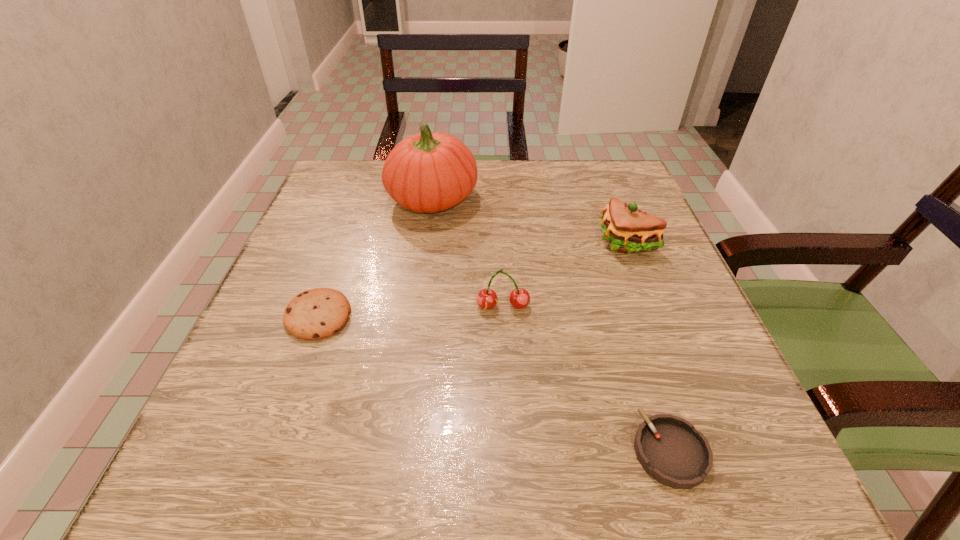
The height and width of the screenshot is (540, 960). In the image, there is a desktop. What are the coordinates of `vacant space at the right edge` in the screenshot? It's located at (619, 309).

This screenshot has width=960, height=540. In the image, there is a desktop. Find the location of `vacant space at the far left corner`. vacant space at the far left corner is located at coordinates (319, 199).

The image size is (960, 540). What are the coordinates of `vacant region at the near right corner of the desktop` in the screenshot? It's located at (675, 500).

Where is `unoccupied position between the cookie and the pumpkin`? This screenshot has width=960, height=540. unoccupied position between the cookie and the pumpkin is located at coordinates (375, 257).

You are a GUI agent. You are given a task and a screenshot of the screen. Output one action in this format:
    pyautogui.click(x=<x>, y=<y>)
    Task: Click on the free point between the nearest object and the sandwich
    The width and height of the screenshot is (960, 540).
    Given the screenshot: What is the action you would take?
    pyautogui.click(x=648, y=346)

Where is `vacant area between the third shortest object and the cookie`? The image size is (960, 540). vacant area between the third shortest object and the cookie is located at coordinates (411, 312).

What are the coordinates of `vacant region between the leftmost object and the second tallest object` in the screenshot? It's located at (472, 279).

You are a GUI agent. You are given a task and a screenshot of the screen. Output one action in this format:
    pyautogui.click(x=<x>, y=<y>)
    Task: Click on the free space that is in between the nearest object and the second tallest object
    This screenshot has height=540, width=960.
    Given the screenshot: What is the action you would take?
    pyautogui.click(x=648, y=346)

Locate an element on the screen. This screenshot has width=960, height=540. free space between the sandwich and the pumpkin is located at coordinates point(529,220).

What are the coordinates of `free space between the cherry and the fourth shortest object` in the screenshot? It's located at (564, 275).